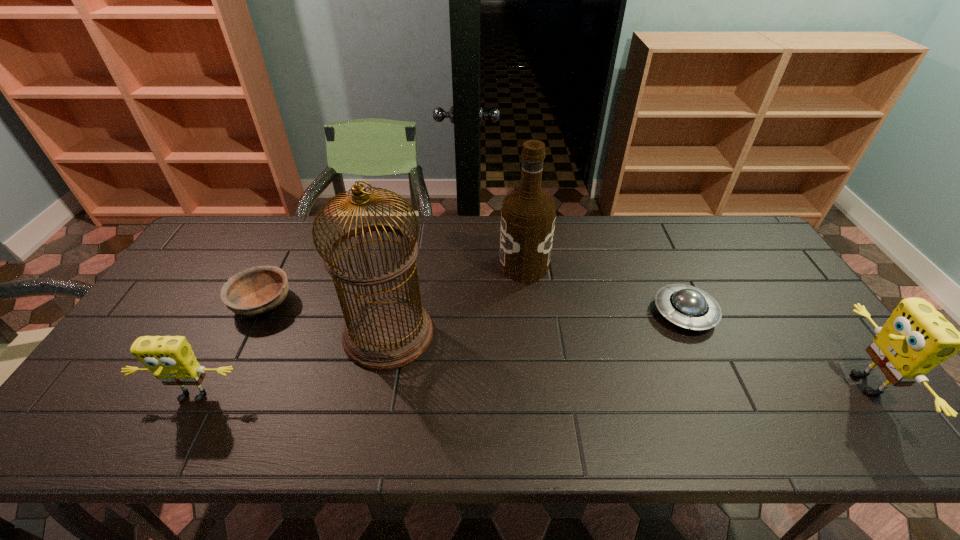
Identify the location of vacant space that's between the fourth object from left to right and the saucer. Image resolution: width=960 pixels, height=540 pixels. 604,289.

Locate an element on the screen. free space between the fourth shortest object and the saucer is located at coordinates coord(774,348).

This screenshot has height=540, width=960. I want to click on vacant area between the fifth object from left to right and the taller sponge, so click(x=774, y=348).

At what (x,y) coordinates should I click in order to perform the action: click on vacant area that lies between the fifth object from left to right and the left sponge. Please return your answer as a coordinate pair (x, y). The width and height of the screenshot is (960, 540). Looking at the image, I should click on pyautogui.click(x=439, y=355).

Locate an element on the screen. This screenshot has width=960, height=540. unoccupied position between the fourth object from right to left and the fourth shortest object is located at coordinates (626, 359).

Locate an element on the screen. the third closest object to the bowl is located at coordinates (528, 215).

The image size is (960, 540). In order to click on object that is the fifth closest to the fourth object from right to left in this screenshot , I will do `click(916, 338)`.

The image size is (960, 540). I want to click on free region that satisfies the following two spatial constraints: 1. on the label of the third object from right to left; 2. on the back side of the saucer, so click(529, 313).